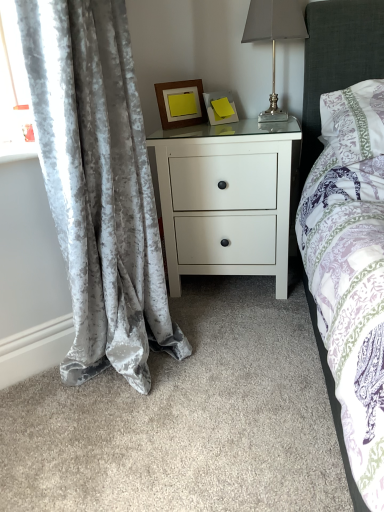
The height and width of the screenshot is (512, 384). In order to click on vacant space in front of metallic silver table lamp at upper right in this screenshot , I will do `click(265, 133)`.